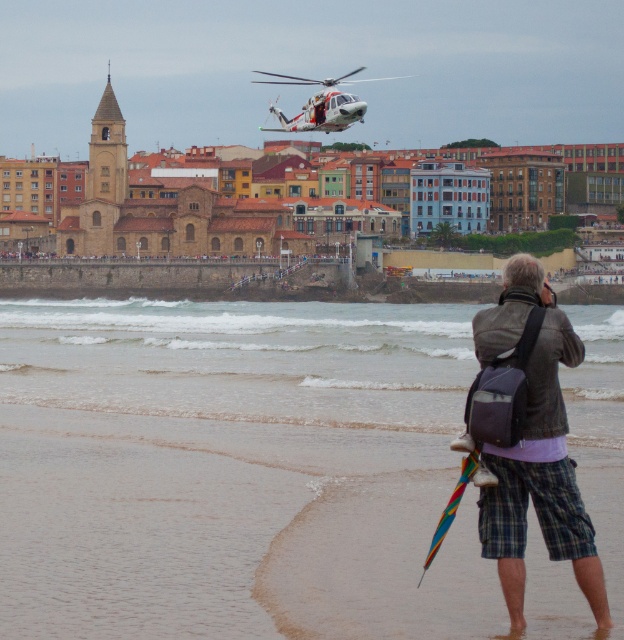
Question: Among these points, which one is farthest from the camera?

Choices:
 (A) (544, 401)
 (B) (270, 365)

Answer: (B)

Question: Is sandy beach at lower left to the right of white matte helicopter at upper center from the viewer's perspective?

Choices:
 (A) no
 (B) yes

Answer: (A)

Question: Can you confirm if sandy beach at lower left is positioned to the left of leather jacket at lower right?

Choices:
 (A) yes
 (B) no

Answer: (A)

Question: Which point is farther from the camera taking this photo?

Choices:
 (A) (308, 432)
 (B) (485, 310)
 (C) (319, 102)

Answer: (C)

Question: Which of the following is the farthest from the observer?

Choices:
 (A) leather jacket at lower right
 (B) sandy beach at lower left

Answer: (B)

Question: Where is sandy beach at lower left located in relation to white matte helicopter at upper center in the image?

Choices:
 (A) right
 (B) left

Answer: (B)